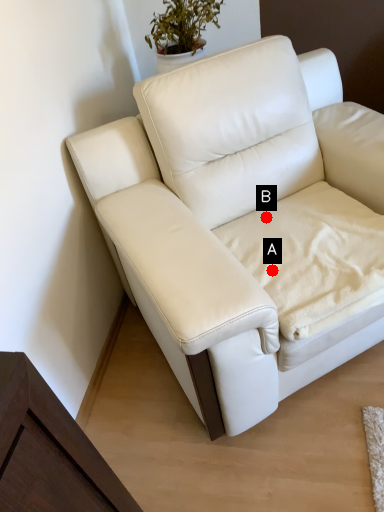
Question: Two points are circled on the image, labeled by A and B beside each circle. Which of the following is the farthest from the observer?

Choices:
 (A) A is further
 (B) B is further

Answer: (B)